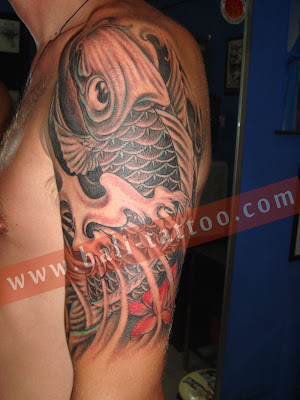
The height and width of the screenshot is (400, 300). Find the location of `chest`. chest is located at coordinates tap(35, 332).